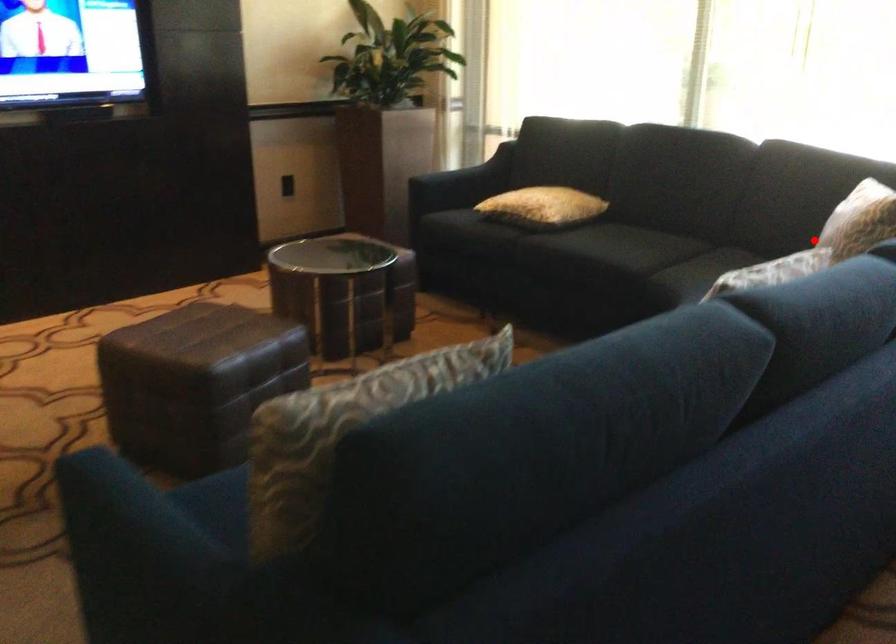
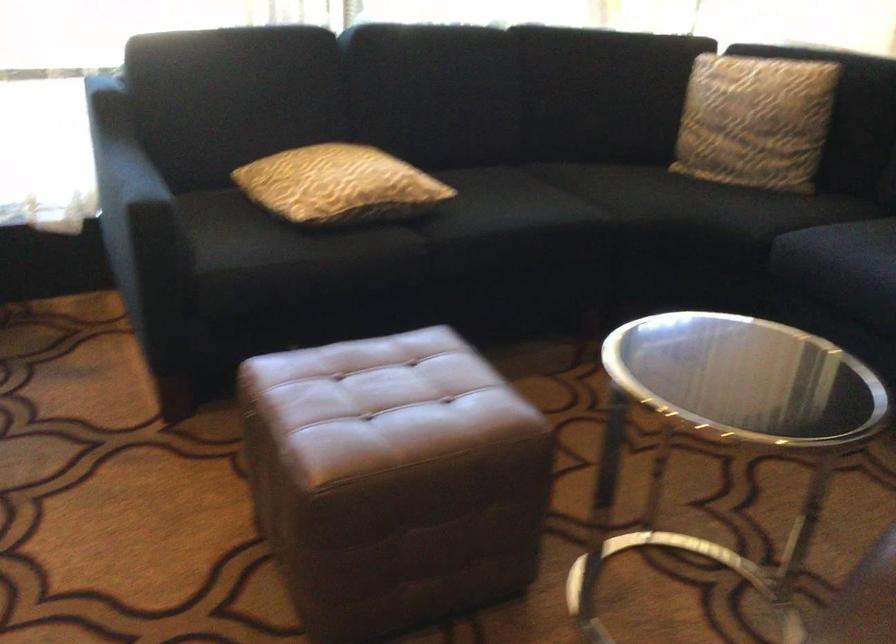
Locate, in the second image, the point that corresponds to the highlighted location in the first image.

(754, 120)